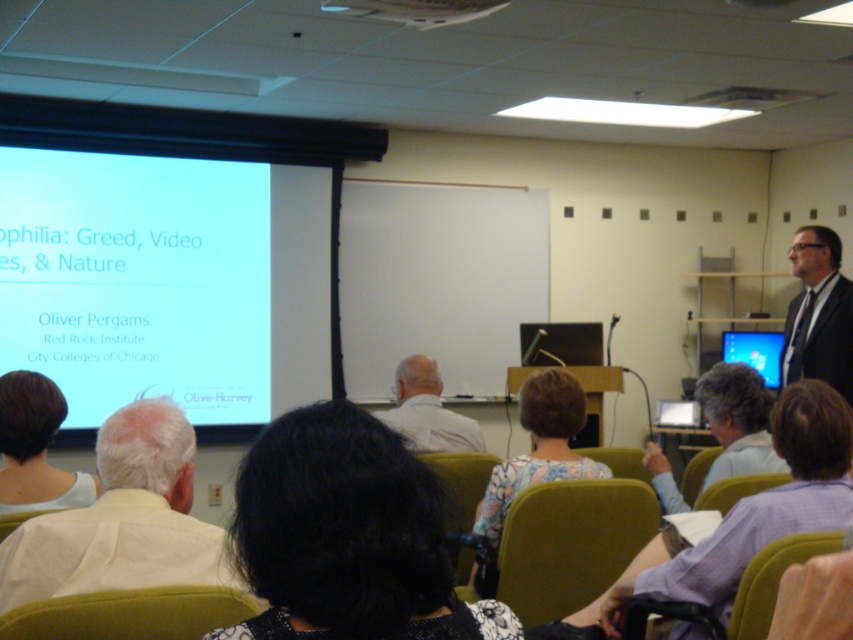
Which is behind, point (102, 477) or point (662, 472)?

The point (662, 472) is more distant.

Can you confirm if white fabric shirt at lower left is thinner than gray fabric shirt at lower right?

In fact, white fabric shirt at lower left might be wider than gray fabric shirt at lower right.

Is point (184, 419) in front of point (732, 396)?

That is True.

Where is `white fabric shirt at lower left`? white fabric shirt at lower left is located at coordinates (123, 518).

Who is lower down, black hair at center or white matte shirt at center?

white matte shirt at center

Is black hair at center to the left of white matte shirt at center from the viewer's perspective?

Incorrect, black hair at center is not on the left side of white matte shirt at center.

Find the location of a particular element. black hair at center is located at coordinates (347, 536).

Between dark blue suit at right and metallic projector at upper center, which one appears on the right side from the viewer's perspective?

dark blue suit at right is more to the right.

Does dark blue suit at right have a larger size compared to metallic projector at upper center?

Yes.

The image size is (853, 640). I want to click on dark blue suit at right, so 817,314.